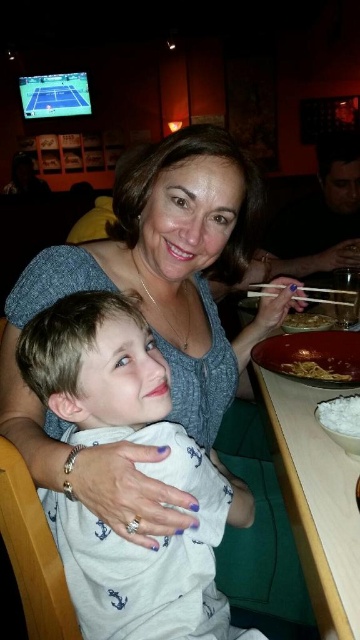
Question: Which of these objects is positioned closest to the yellow matte noodles at center?

Choices:
 (A) wooden table at right
 (B) wooden chopsticks at upper center

Answer: (A)

Question: Which point is farther to the camera?

Choices:
 (A) (303, 362)
 (B) (74, 538)
 (C) (318, 300)
 (D) (344, 417)

Answer: (C)

Question: Does wooden table at right have a larger size compared to brown matte bowl at center?

Choices:
 (A) yes
 (B) no

Answer: (A)

Question: Which point is farther to the camera?

Choices:
 (A) white fluffy rice at lower right
 (B) wooden chopsticks at upper center

Answer: (B)

Question: Is wooden table at right smaller than brown matte bowl at center?

Choices:
 (A) yes
 (B) no

Answer: (B)

Question: Does white cotton shirt at center have a greater width compared to white fluffy rice at lower right?

Choices:
 (A) yes
 (B) no

Answer: (A)